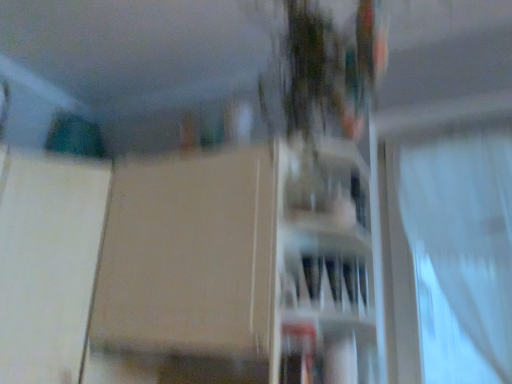
Question: Is matte white vase at center taller or shorter than transparent glass window at upper right?

Choices:
 (A) short
 (B) tall

Answer: (A)

Question: Is matte white vase at center situated inside transparent glass window at upper right or outside?

Choices:
 (A) inside
 (B) outside

Answer: (B)

Question: Which object is the closest to the white matte screen door at left?

Choices:
 (A) transparent glass window at upper right
 (B) matte white vase at center
 (C) white sheer curtain at right

Answer: (B)

Question: Estimate the real-world distances between objects in this image. Which object is closer to the matte white vase at center?

Choices:
 (A) transparent glass window at upper right
 (B) white matte screen door at left
 (C) white sheer curtain at right

Answer: (A)